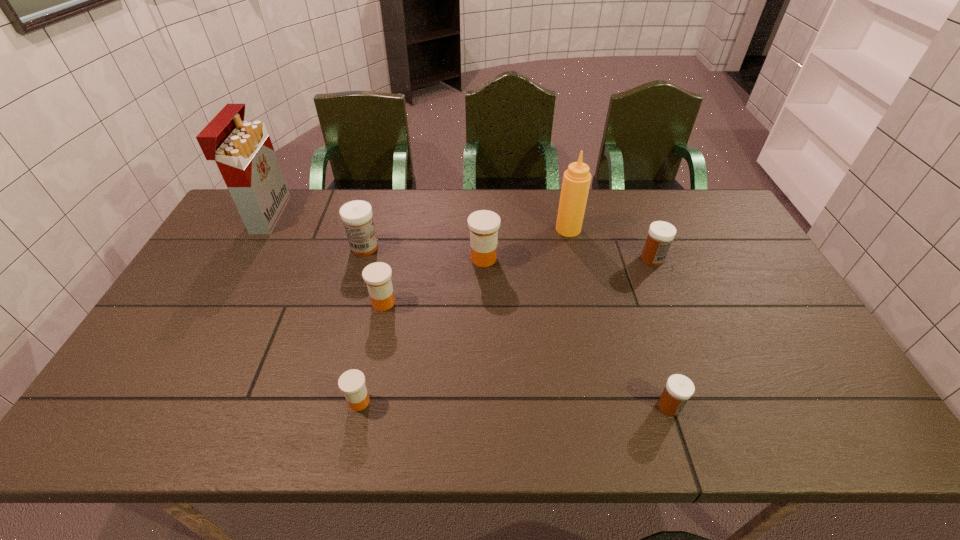
Identify the location of the second smallest white medicine. The image size is (960, 540). (660, 234).

Identify the location of the rightmost medicine. This screenshot has width=960, height=540. (660, 234).

Find the location of `the nearest white medicine`. the nearest white medicine is located at coordinates (679, 388).

Where is `the smallest white medicine`? The image size is (960, 540). the smallest white medicine is located at coordinates click(679, 388).

Locate an element on the screen. The width and height of the screenshot is (960, 540). the smallest orange medicine is located at coordinates (352, 382).

This screenshot has height=540, width=960. I want to click on vacant region located 0.250m with the lid open on the leftmost object, so click(x=353, y=214).

Where is `free location located on the front of the condiment`? The height and width of the screenshot is (540, 960). free location located on the front of the condiment is located at coordinates (592, 335).

This screenshot has width=960, height=540. Identify the location of free region located on the label of the farthest orange medicine. (426, 259).

The image size is (960, 540). I want to click on free location located 0.340m on the label of the farthest orange medicine, so click(x=359, y=259).

Image resolution: width=960 pixels, height=540 pixels. Find the location of `vacant space located 0.330m on the label of the farthest orange medicine`. vacant space located 0.330m on the label of the farthest orange medicine is located at coordinates (362, 259).